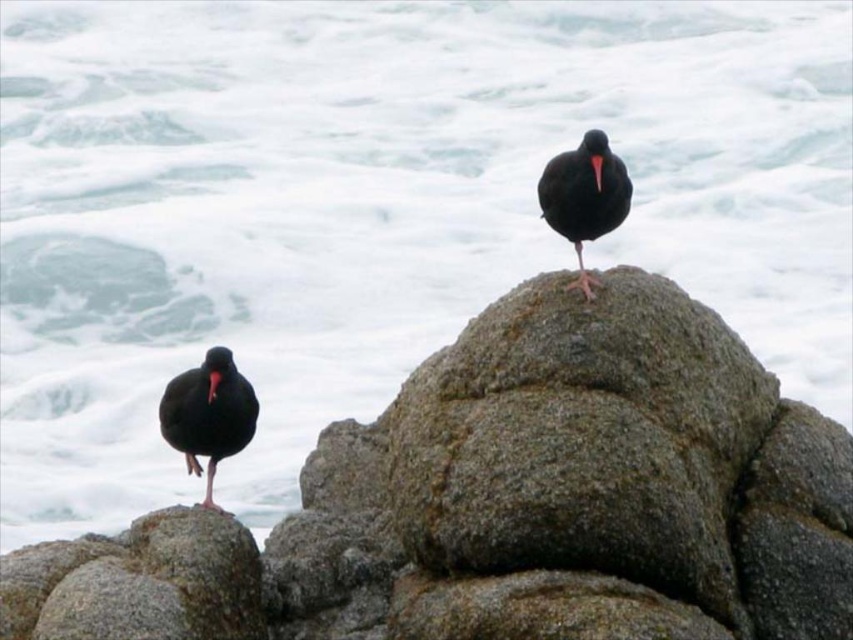
You are a birdwatcher observing the scene. You notice the matte black bird at left and the black glossy beak at lower left. Which object is closer to you, the observer?

The matte black bird at left is closer to you because the black glossy beak at lower left is behind it.

You are a birdwatcher observing the scene. You notice the matte black bird at left and the black glossy beak at lower left. Which object is closer to the viewer?

The black glossy beak at lower left is closer to the viewer because it is positioned above the matte black bird at left, which is underneath it.